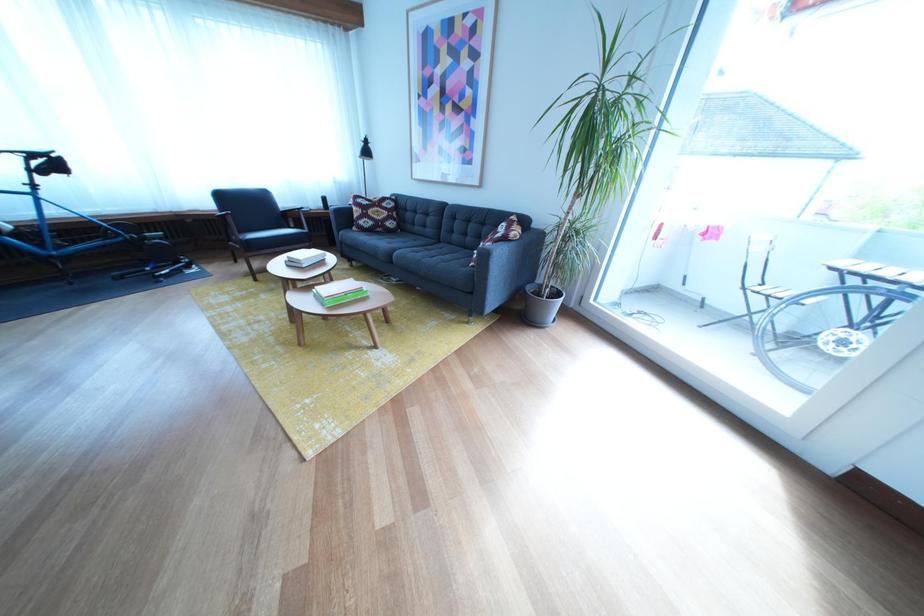
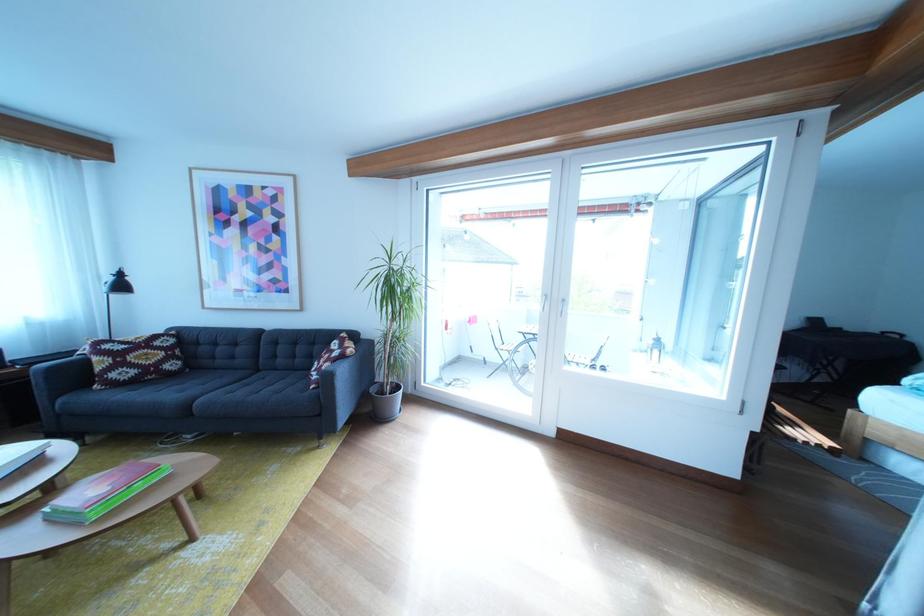
Question: The camera is either moving clockwise (left) or counter-clockwise (right) around the object. The first image is from the beginning of the video and the second image is from the end. Is the camera moving left or right when shooting the video?

Choices:
 (A) Left
 (B) Right

Answer: (A)